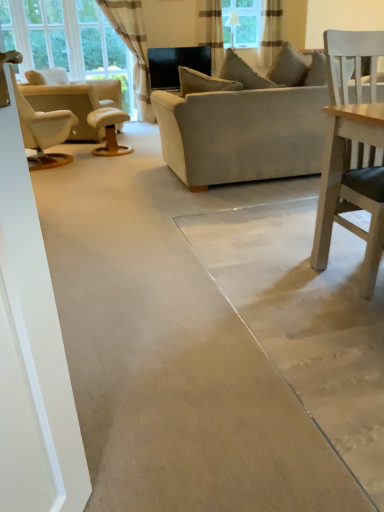
Question: Can you confirm if wooden stool at center is shorter than white striped curtain at upper left, placed as the third curtain when sorted from right to left?

Choices:
 (A) yes
 (B) no

Answer: (A)

Question: Is wooden stool at center to the right of white striped curtain at upper left, placed as the first curtain when sorted from left to right, from the viewer's perspective?

Choices:
 (A) yes
 (B) no

Answer: (A)

Question: Is wooden stool at center outside white striped curtain at upper left, placed as the first curtain when sorted from left to right?

Choices:
 (A) yes
 (B) no

Answer: (A)

Question: Is white striped curtain at upper left, placed as the first curtain when sorted from left to right, located within wooden stool at center?

Choices:
 (A) no
 (B) yes

Answer: (A)

Question: Could you tell me if wooden stool at center is turned towards white striped curtain at upper left, placed as the third curtain when sorted from right to left?

Choices:
 (A) yes
 (B) no

Answer: (B)

Question: From a real-world perspective, is wooden stool at center located higher than white striped curtain at upper left, placed as the third curtain when sorted from right to left?

Choices:
 (A) yes
 (B) no

Answer: (B)

Question: Is striped fabric curtain at upper center, which is the second curtain from left to right, positioned behind striped fabric curtain at upper center, marked as the 3th curtain in a left-to-right arrangement?

Choices:
 (A) no
 (B) yes

Answer: (A)

Question: Is striped fabric curtain at upper center, the 2th curtain from the right, in contact with striped fabric curtain at upper center, marked as the 3th curtain in a left-to-right arrangement?

Choices:
 (A) no
 (B) yes

Answer: (A)

Question: From a real-world perspective, is striped fabric curtain at upper center, the 2th curtain from the right, below striped fabric curtain at upper center, marked as the 3th curtain in a left-to-right arrangement?

Choices:
 (A) no
 (B) yes

Answer: (A)

Question: Considering the relative positions of striped fabric curtain at upper center, the 2th curtain from the right, and striped fabric curtain at upper center, marked as the 3th curtain in a left-to-right arrangement, in the image provided, is striped fabric curtain at upper center, the 2th curtain from the right, to the right of striped fabric curtain at upper center, marked as the 3th curtain in a left-to-right arrangement, from the viewer's perspective?

Choices:
 (A) yes
 (B) no

Answer: (B)

Question: Does striped fabric curtain at upper center, the 2th curtain from the right, have a greater width compared to striped fabric curtain at upper center, marked as the first curtain in a right-to-left arrangement?

Choices:
 (A) yes
 (B) no

Answer: (A)

Question: Considering the relative sizes of striped fabric curtain at upper center, the 2th curtain from the right, and striped fabric curtain at upper center, marked as the 3th curtain in a left-to-right arrangement, in the image provided, is striped fabric curtain at upper center, the 2th curtain from the right, taller than striped fabric curtain at upper center, marked as the 3th curtain in a left-to-right arrangement,?

Choices:
 (A) no
 (B) yes

Answer: (B)

Question: Is wooden stool at center beside white leather recliner at left?

Choices:
 (A) yes
 (B) no

Answer: (B)